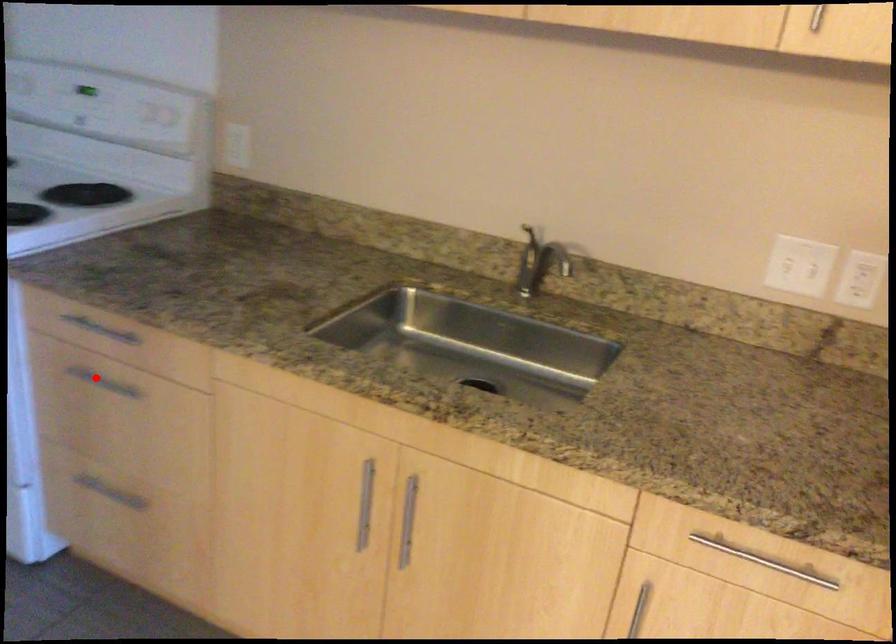
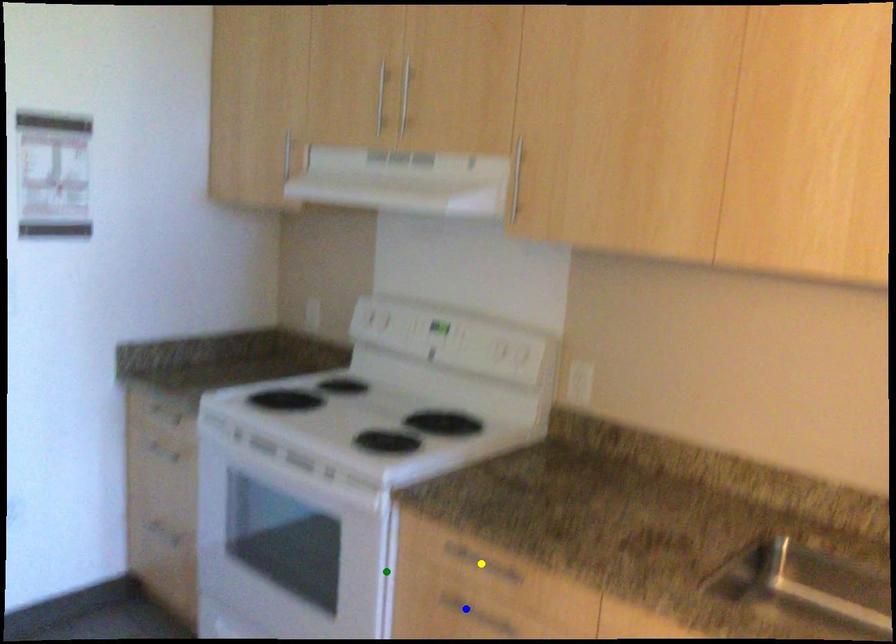
Question: I am providing you with two images of the same scene from different viewpoints. A red point is marked on the first image. You are given multiple points on the second image. Which point in image 2 represents the same 3d spot as the red point in image 1?

Choices:
 (A) yellow point
 (B) green point
 (C) blue point

Answer: (C)